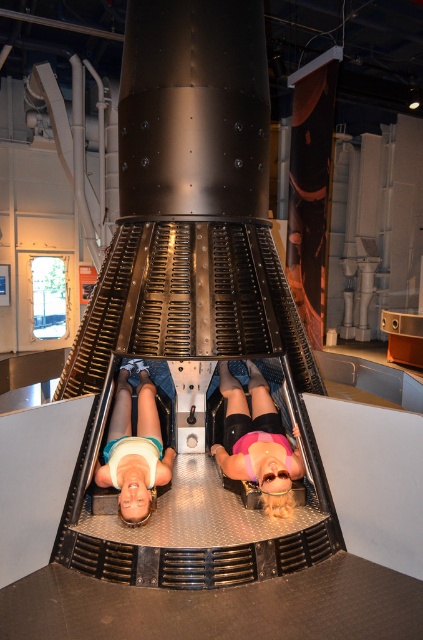
You are an astronaut preparing for a mission and see the pink matte shorts at center and the matte white shirt at center in the space capsule exhibit. Which clothing item is located to the right of the other?

The pink matte shorts at center is positioned on the right side of matte white shirt at center.

You are an astronaut preparing for a mission and need to ensure your equipment fits inside the space capsule. Given the limited space, which item among the pink matte shorts at center and the matte white shirt at center takes up more vertical space?

The pink matte shorts at center has a greater height compared to the matte white shirt at center, so it takes up more vertical space.

You are an astronaut preparing for a mission and need to ensure there is enough space between your equipment and your suit. You see the pink matte shorts at center and the matte white shirt at center in the space capsule. Is there sufficient space between them for a 50 cm safety margin?

The distance between the pink matte shorts at center and the matte white shirt at center is 65.66 centimeters, which exceeds the required 50 cm safety margin. Therefore, there is sufficient space between them.